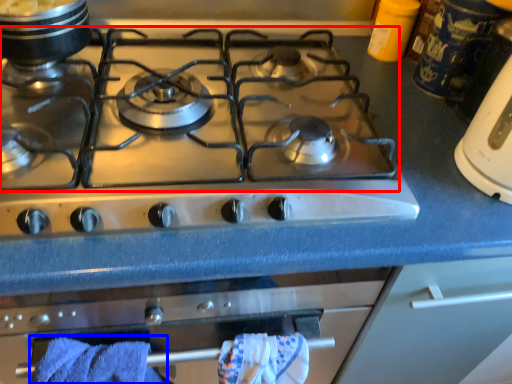
Question: Among these objects, which one is farthest to the camera, gas stove (highlighted by a red box) or bath towel (highlighted by a blue box)?

Choices:
 (A) gas stove
 (B) bath towel

Answer: (B)